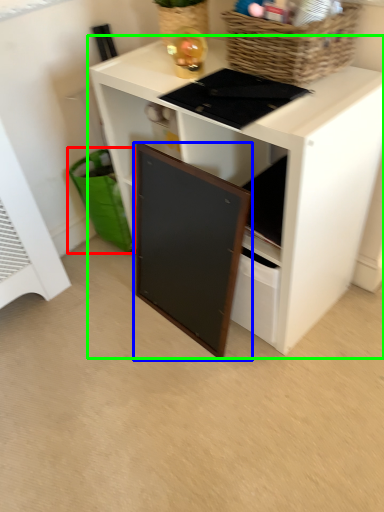
Question: Which object is positioned closest to shopping basket (highlighted by a red box)? Select from cabinetry (highlighted by a blue box) and desk (highlighted by a green box).

Choices:
 (A) cabinetry
 (B) desk

Answer: (A)